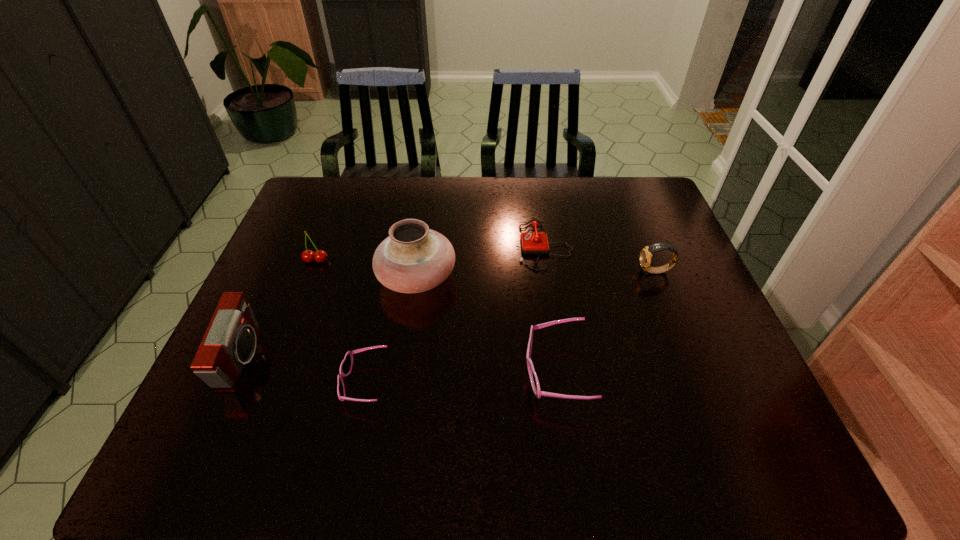
I want to click on the shorter sunglasses, so click(346, 366).

In order to click on the left sunglasses in this screenshot , I will do `click(346, 366)`.

Find the location of a particular element. This screenshot has height=540, width=960. the taller sunglasses is located at coordinates click(x=538, y=393).

Identify the location of the right sunglasses. tap(538, 393).

The height and width of the screenshot is (540, 960). I want to click on telephone, so click(534, 242).

Locate an element on the screen. the rightmost object is located at coordinates (646, 254).

Where is `the sixth object from right to left`? Image resolution: width=960 pixels, height=540 pixels. the sixth object from right to left is located at coordinates 320,256.

Locate an element on the screen. The height and width of the screenshot is (540, 960). the sixth shortest object is located at coordinates (229, 342).

Locate an element on the screen. The height and width of the screenshot is (540, 960). camera is located at coordinates (229, 342).

Locate an element on the screen. pottery is located at coordinates (414, 258).